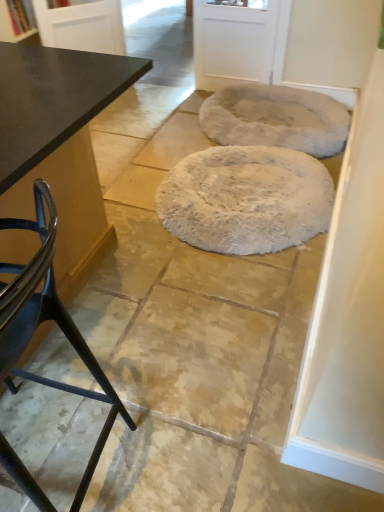
You are a GUI agent. You are given a task and a screenshot of the screen. Output one action in this format:
    pyautogui.click(x=<x>, y=<y>)
    Task: Click on the free area in between matte black chair at left and white fluffy rug at center, the 1th mat when ordered from front to back
    
    Given the screenshot: What is the action you would take?
    pyautogui.click(x=193, y=328)